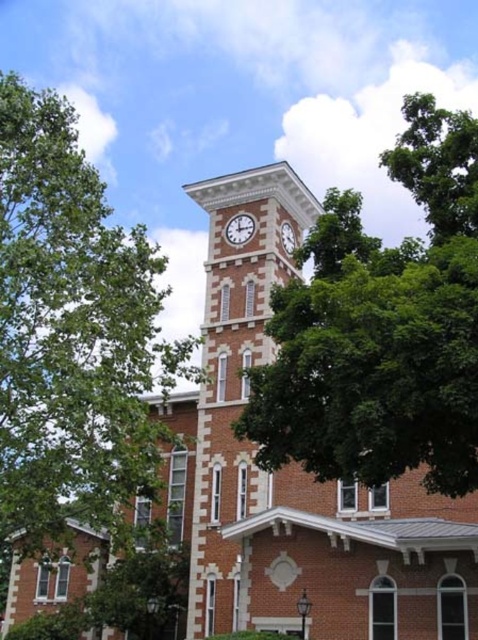
Question: Which object is positioned farthest from the green leafy tree at upper center?

Choices:
 (A) white stone clock at upper center
 (B) white brick clock at upper center

Answer: (A)

Question: Which point appears closest to the camera in this image?

Choices:
 (A) (215, 513)
 (B) (293, 236)

Answer: (A)

Question: Is green leafy tree at left smaller than white brick clock at upper center?

Choices:
 (A) yes
 (B) no

Answer: (B)

Question: Is brick clock tower at center bigger than white stone clock at upper center?

Choices:
 (A) no
 (B) yes

Answer: (B)

Question: Which object appears farthest from the camera in this image?

Choices:
 (A) white stone clock at upper center
 (B) brick clock tower at center
 (C) green leafy tree at left
 (D) white brick clock at upper center

Answer: (A)

Question: Does white brick clock at upper center have a smaller size compared to white stone clock at upper center?

Choices:
 (A) yes
 (B) no

Answer: (B)